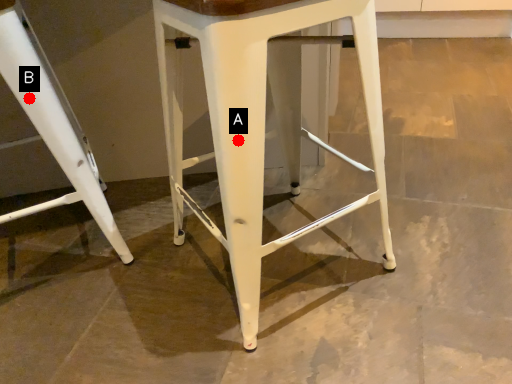
Question: Two points are circled on the image, labeled by A and B beside each circle. Among these points, which one is nearest to the camera?

Choices:
 (A) A is closer
 (B) B is closer

Answer: (A)